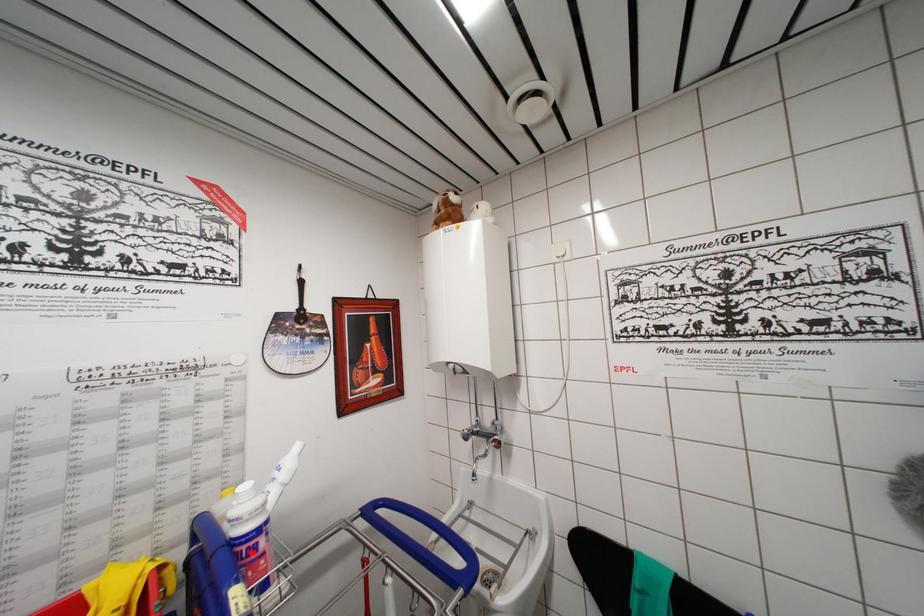
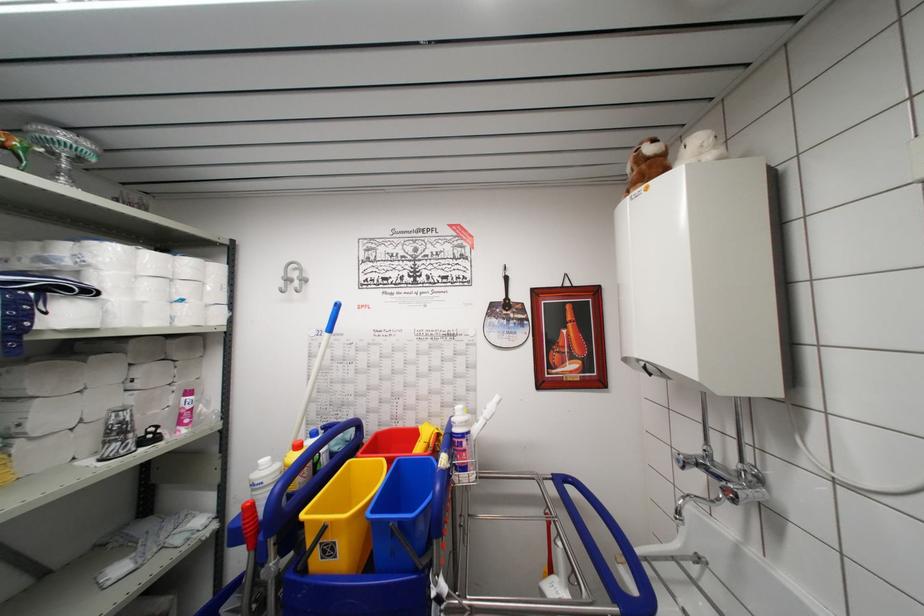
Where in the second image is the point corresponding to the highlighted location from the first image?

(460, 447)